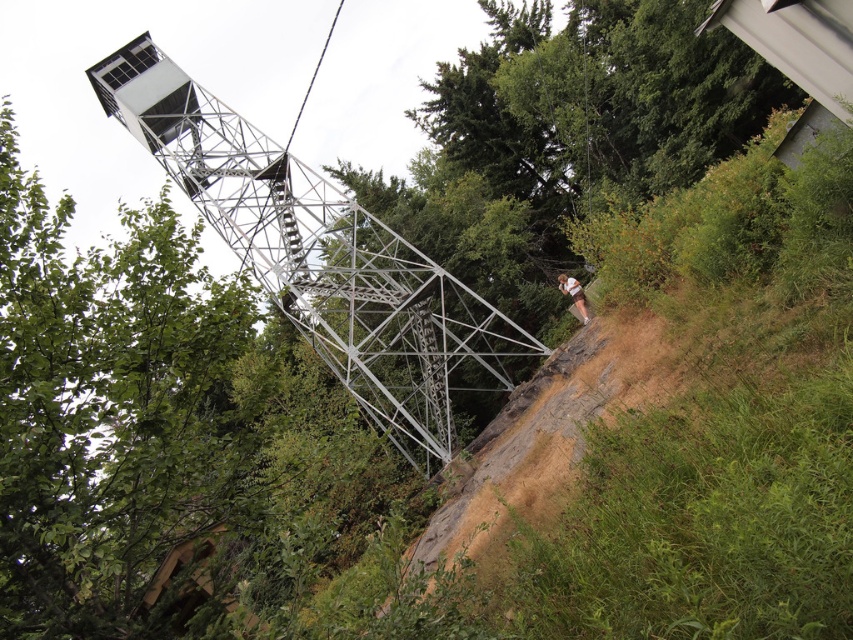
You are standing at the base of the fire tower and looking towards the observation deck. There are two points marked on the tower structure. One is at coordinates point (659,340) and the other is at point (587,310). Which point is closer to you when viewed from this position?

Point (587,310) is closer to you because it is behind point (659,340) when viewed from the base of the fire tower.